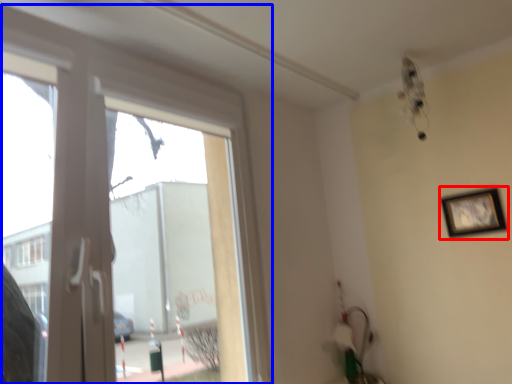
Question: Which of the following is the closest to the observer, picture frame (highlighted by a red box) or window (highlighted by a blue box)?

Choices:
 (A) picture frame
 (B) window

Answer: (B)